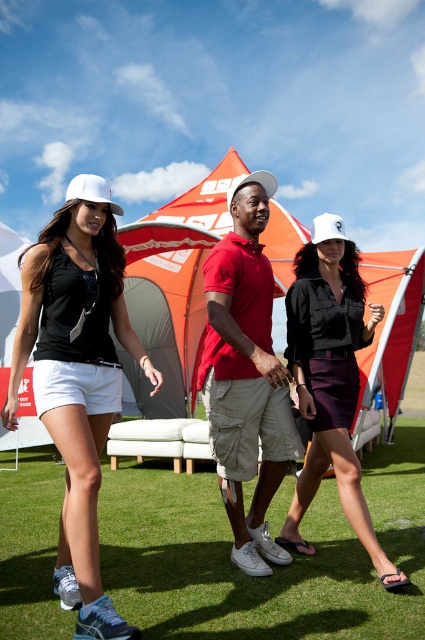
You are standing in the scene and want to hand a flyer to the person wearing the matte black skirt at center. Considering the distance between you and them, can you comfortably walk over to deliver the flyer without needing to shout?

The distance between the matte black skirt at center and the viewer is 3.67 meters. This distance is reasonable for walking over to deliver the flyer comfortably without needing to shout.

Based on the scene description, which object is taller between the matte black skirt at center and the white matte baseball hat at center?

The matte black skirt at center is taller than the white matte baseball hat at center according to the description.

You are a photographer trying to capture a closeup shot of the white cap worn by the person in the center. Given that the point at coordinates (x=246, y=381) is on the matte red polo shirt at center, where should you focus your camera to ensure the white cap is in focus?

To capture the white cap worn by the person in the center in focus, you should focus your camera on the point at coordinates (x=246, y=381) since it is located on the matte red polo shirt at center, which is part of the same individual.